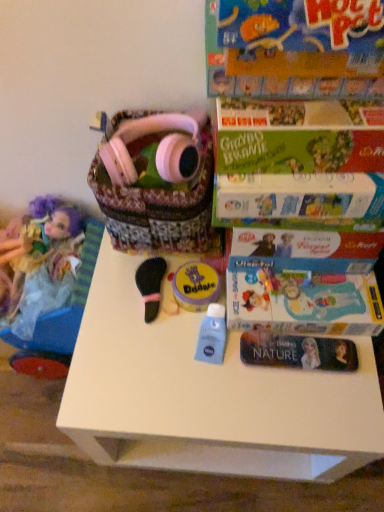
Where is `green cardboard book at upper right, which appears as the 1th paperback book when viewed from the front`? The image size is (384, 512). green cardboard book at upper right, which appears as the 1th paperback book when viewed from the front is located at coordinates (298, 161).

Describe the element at coordinates (212, 336) in the screenshot. I see `blue matte lotion at center` at that location.

Locate an element on the screen. matte cardboard book at upper right, the 1th paperback book in the back-to-front sequence is located at coordinates (301, 292).

Identify the location of black felt brush at center, which is the 1th toy in left-to-right order. (151, 285).

This screenshot has width=384, height=512. Describe the element at coordinates (151, 285) in the screenshot. I see `black felt brush at center, positioned as the second toy in right-to-left order` at that location.

The height and width of the screenshot is (512, 384). What do you see at coordinates (156, 182) in the screenshot? I see `pink fabric basket at upper center` at bounding box center [156, 182].

Find the location of `pink matte headphones at upper center`. pink matte headphones at upper center is located at coordinates (157, 148).

Considering the sizes of objects black felt brush at center, positioned as the second toy in right-to-left order, and matte cardboard book at upper right, the 1th paperback book in the back-to-front sequence, in the image provided, who is thinner, black felt brush at center, positioned as the second toy in right-to-left order, or matte cardboard book at upper right, the 1th paperback book in the back-to-front sequence,?

black felt brush at center, positioned as the second toy in right-to-left order.

Is black felt brush at center, which is the 1th toy in left-to-right order, facing away from matte cardboard book at upper right, the 1th paperback book in the back-to-front sequence?

That's not correct — black felt brush at center, which is the 1th toy in left-to-right order, is not looking away from matte cardboard book at upper right, the 1th paperback book in the back-to-front sequence.

Is black felt brush at center, which is the 1th toy in left-to-right order, next to matte cardboard book at upper right, the 1th paperback book in the back-to-front sequence?

black felt brush at center, which is the 1th toy in left-to-right order, is not next to matte cardboard book at upper right, the 1th paperback book in the back-to-front sequence, and they're not touching.

From the image's perspective, is black felt brush at center, positioned as the second toy in right-to-left order, on matte cardboard book at upper right, acting as the 2th paperback book starting from the front?

No.

Does white plastic table at center lie in front of matte purple doll at left?

Yes, the depth of white plastic table at center is less than that of matte purple doll at left.

Is white plastic table at center outside of matte purple doll at left?

white plastic table at center is positioned outside matte purple doll at left.

From the image's perspective, is white plastic table at center over matte purple doll at left?

Incorrect, from the image's perspective, white plastic table at center is lower than matte purple doll at left.

Considering the sizes of objects white plastic table at center and matte purple doll at left in the image provided, who is shorter, white plastic table at center or matte purple doll at left?

matte purple doll at left.

Which point is more forward, (214, 337) or (145, 302)?

The point (214, 337) is more forward.

From the image's perspective, is blue matte lotion at center above black felt brush at center, positioned as the second toy in right-to-left order?

No, from the image's perspective, blue matte lotion at center is not on top of black felt brush at center, positioned as the second toy in right-to-left order.

Looking at this image, is blue matte lotion at center taller or shorter than black felt brush at center, which is the 1th toy in left-to-right order?

Considering their sizes, blue matte lotion at center has more height than black felt brush at center, which is the 1th toy in left-to-right order.

Can black felt brush at center, which is the 1th toy in left-to-right order, be found inside blue matte lotion at center?

Definitely not — black felt brush at center, which is the 1th toy in left-to-right order, is not inside blue matte lotion at center.

Is pink matte headphones at upper center smaller than black felt brush at center, which is the 1th toy in left-to-right order?

Actually, pink matte headphones at upper center might be larger than black felt brush at center, which is the 1th toy in left-to-right order.

From their relative heights in the image, would you say pink matte headphones at upper center is taller or shorter than black felt brush at center, positioned as the second toy in right-to-left order?

In the image, pink matte headphones at upper center appears to be taller than black felt brush at center, positioned as the second toy in right-to-left order.

Is the position of pink matte headphones at upper center more distant than that of black felt brush at center, which is the 1th toy in left-to-right order?

No, it is in front of black felt brush at center, which is the 1th toy in left-to-right order.

Which object is wider, pink matte headphones at upper center or black felt brush at center, which is the 1th toy in left-to-right order?

With larger width is pink matte headphones at upper center.

Does pink matte headphones at upper center lie behind white plastic table at center?

No, it is in front of white plastic table at center.

Does point (172, 147) come farther from viewer compared to point (253, 475)?

No, (172, 147) is in front of (253, 475).

Between pink matte headphones at upper center and white plastic table at center, which one has smaller width?

pink matte headphones at upper center.

From a real-world perspective, is pink matte headphones at upper center beneath white plastic table at center?

Actually, pink matte headphones at upper center is physically above white plastic table at center in the real world.

Is pink fabric basket at upper center oriented away from yellow matte doodle at center, the second toy when ordered from left to right?

pink fabric basket at upper center is not turned away from yellow matte doodle at center, the second toy when ordered from left to right.

Between pink fabric basket at upper center and yellow matte doodle at center, the second toy when ordered from left to right, which one appears on the right side from the viewer's perspective?

yellow matte doodle at center, the second toy when ordered from left to right, is more to the right.

Based on the photo, is pink fabric basket at upper center with yellow matte doodle at center, which is counted as the first toy, starting from the right?

No.

From a real-world perspective, is pink fabric basket at upper center on top of yellow matte doodle at center, which is counted as the first toy, starting from the right?

Indeed, from a real-world perspective, pink fabric basket at upper center stands above yellow matte doodle at center, which is counted as the first toy, starting from the right.

What's the angular difference between black felt brush at center, which is the 1th toy in left-to-right order, and green cardboard book at upper right, which appears as the 1th paperback book when viewed from the front,'s facing directions?

The angle between the facing direction of black felt brush at center, which is the 1th toy in left-to-right order, and the facing direction of green cardboard book at upper right, which appears as the 1th paperback book when viewed from the front, is 4.44 degrees.

Which object is positioned more to the right, black felt brush at center, which is the 1th toy in left-to-right order, or green cardboard book at upper right, which appears as the 1th paperback book when viewed from the front?

Positioned to the right is green cardboard book at upper right, which appears as the 1th paperback book when viewed from the front.

Does black felt brush at center, which is the 1th toy in left-to-right order, turn towards green cardboard book at upper right, which appears as the 1th paperback book when viewed from the front?

No, black felt brush at center, which is the 1th toy in left-to-right order, is not turned towards green cardboard book at upper right, which appears as the 1th paperback book when viewed from the front.

From the black felt brush at center, which is the 1th toy in left-to-right order, count 2nd paperback book to the right and point to it. Please provide its 2D coordinates.

[(301, 292)]

Locate an element on the screen. Image resolution: width=384 pixels, height=512 pixels. doll located behind the white plastic table at center is located at coordinates (39, 263).

Which object lies nearer to the anchor point blue matte lotion at center, yellow matte doodle at center, which is counted as the first toy, starting from the right, or matte cardboard book at upper right, acting as the 2th paperback book starting from the front?

yellow matte doodle at center, which is counted as the first toy, starting from the right, is closer to blue matte lotion at center.

Which object lies nearer to the anchor point blue matte lotion at center, black felt brush at center, which is the 1th toy in left-to-right order, or white plastic table at center?

black felt brush at center, which is the 1th toy in left-to-right order, is positioned closer to the anchor blue matte lotion at center.

When comparing their distances from yellow matte doodle at center, which is counted as the first toy, starting from the right, does matte purple doll at left or white plastic table at center seem closer?

Among the two, white plastic table at center is located nearer to yellow matte doodle at center, which is counted as the first toy, starting from the right.

When comparing their distances from matte cardboard book at upper right, acting as the 2th paperback book starting from the front, does blue matte lotion at center or pink matte headphones at upper center seem closer?

blue matte lotion at center.

From the image, which object appears to be farther from green cardboard book at upper right, which appears as the 1th paperback book when viewed from the front, blue matte lotion at center or white plastic table at center?

The object further to green cardboard book at upper right, which appears as the 1th paperback book when viewed from the front, is white plastic table at center.

When comparing their distances from pink fabric basket at upper center, does green cardboard book at upper right, which appears as the 1th paperback book when viewed from the front, or yellow matte doodle at center, which is counted as the first toy, starting from the right, seem closer?

green cardboard book at upper right, which appears as the 1th paperback book when viewed from the front, lies closer to pink fabric basket at upper center than the other object.

Which object lies nearer to the anchor point matte cardboard book at upper right, the 1th paperback book in the back-to-front sequence, matte purple doll at left or black felt brush at center, which is the 1th toy in left-to-right order?

Based on the image, black felt brush at center, which is the 1th toy in left-to-right order, appears to be nearer to matte cardboard book at upper right, the 1th paperback book in the back-to-front sequence.

Which object lies further to the anchor point yellow matte doodle at center, the second toy when ordered from left to right, pink matte headphones at upper center or matte purple doll at left?

Based on the image, matte purple doll at left appears to be further to yellow matte doodle at center, the second toy when ordered from left to right.

Find the location of a particular element. headphones between matte purple doll at left and matte cardboard book at upper right, the 1th paperback book in the back-to-front sequence, from left to right is located at coordinates (157, 148).

Locate an element on the screen. The height and width of the screenshot is (512, 384). paperback book between green cardboard book at upper right, acting as the 2th paperback book starting from the back, and blue matte lotion at center from top to bottom is located at coordinates (301, 292).

This screenshot has width=384, height=512. In order to click on basket between green cardboard book at upper right, which appears as the 1th paperback book when viewed from the front, and blue matte lotion at center, in the vertical direction in this screenshot , I will do `click(156, 182)`.

The image size is (384, 512). In order to click on headphones between matte purple doll at left and blue matte lotion at center in this screenshot , I will do `click(157, 148)`.